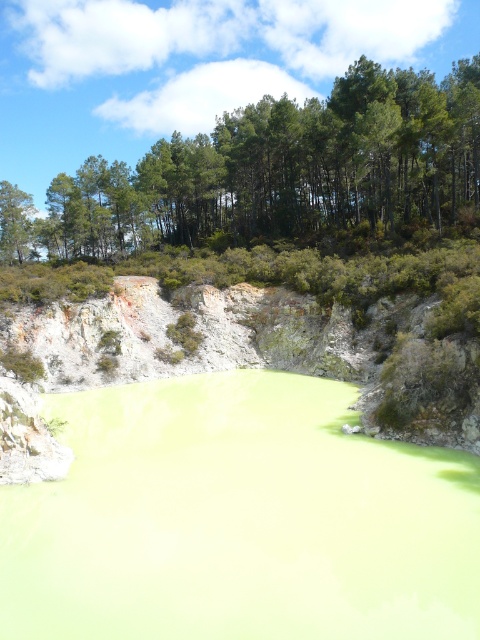
Between green liquid at center and greenish-yellow clay at center, which one is positioned lower?

Answer: green liquid at center is lower down.

From the picture: Is green liquid at center below greenish-yellow clay at center?

Yes, green liquid at center is below greenish-yellow clay at center.

Is point (66, 589) more distant than point (347, 378)?

No, it is not.

The image size is (480, 640). What are the coordinates of `green liquid at center` in the screenshot? It's located at (239, 518).

Between point (457, 81) and point (199, 323), which one is positioned behind?

Positioned behind is point (457, 81).

Is green leafy trees at upper center bigger than greenish-yellow clay at center?

Yes.

Who is more forward, (396, 179) or (385, 385)?

Point (385, 385) is in front.

Locate an element on the screen. The width and height of the screenshot is (480, 640). green leafy trees at upper center is located at coordinates (276, 173).

Who is taller, green liquid at center or green leafy trees at upper center?

green leafy trees at upper center is taller.

Between green liquid at center and green leafy trees at upper center, which one is positioned lower?

green liquid at center is below.

Where is `green liquid at center`? The height and width of the screenshot is (640, 480). green liquid at center is located at coordinates (239, 518).